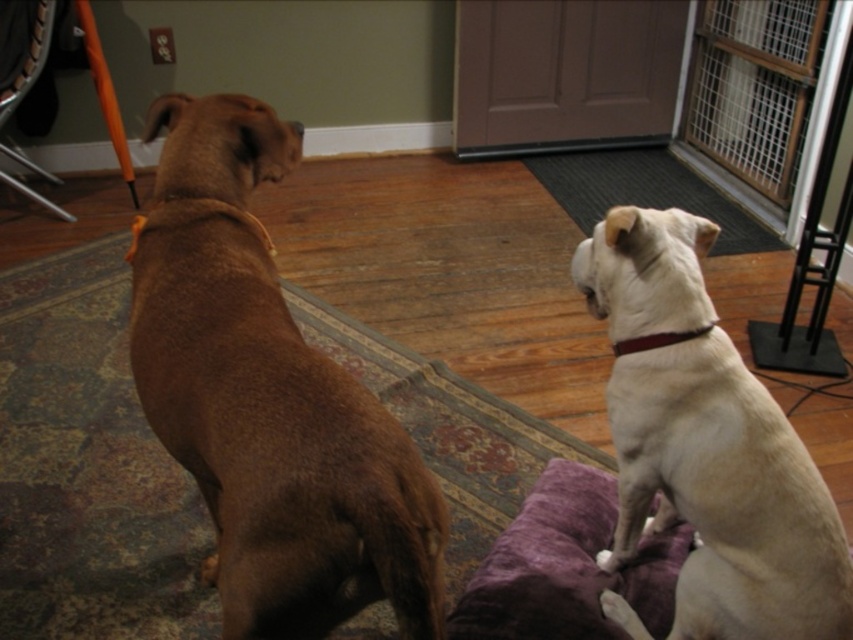
Question: Can you confirm if white leather dog at upper right is wider than purple plush dog bed at center?

Choices:
 (A) yes
 (B) no

Answer: (B)

Question: Which of these objects is positioned farthest from the brown fur dog at left?

Choices:
 (A) white leather dog at upper right
 (B) purple plush dog bed at center

Answer: (B)

Question: Among these objects, which one is nearest to the camera?

Choices:
 (A) white leather dog at upper right
 (B) brown fur dog at left
 (C) purple plush dog bed at center

Answer: (B)

Question: Is brown fur dog at left smaller than white leather dog at upper right?

Choices:
 (A) no
 (B) yes

Answer: (A)

Question: Which point is farther to the camera?

Choices:
 (A) (569, 554)
 (B) (753, 493)
 (C) (242, 548)

Answer: (A)

Question: Is brown fur dog at left to the right of white leather dog at upper right from the viewer's perspective?

Choices:
 (A) yes
 (B) no

Answer: (B)